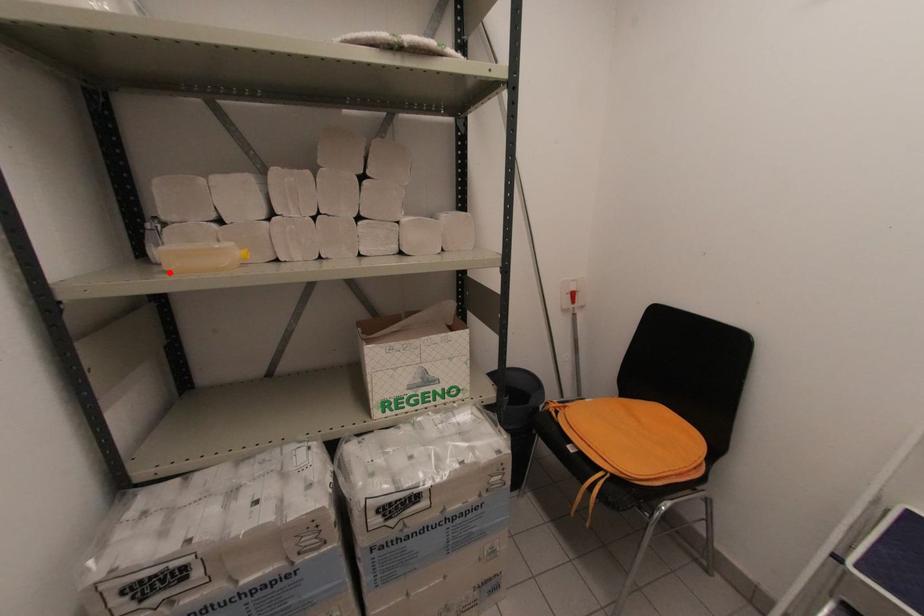
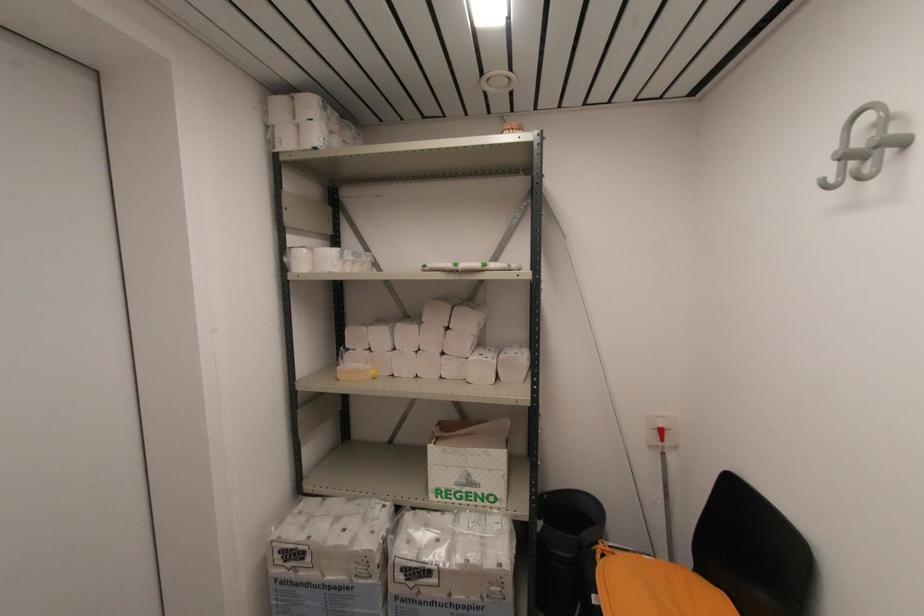
Where in the second image is the point corresponding to the highlighted location from the first image?

(339, 381)